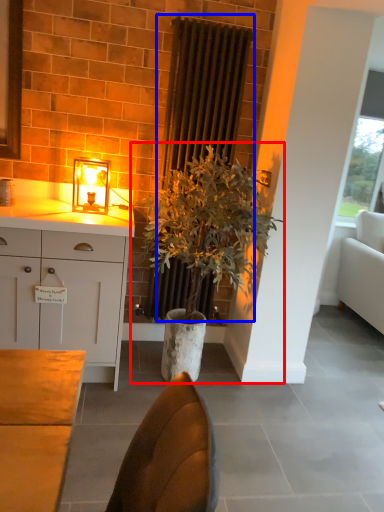
Question: Among these objects, which one is nearest to the camera, houseplant (highlighted by a red box) or radiator (highlighted by a blue box)?

Choices:
 (A) houseplant
 (B) radiator

Answer: (A)